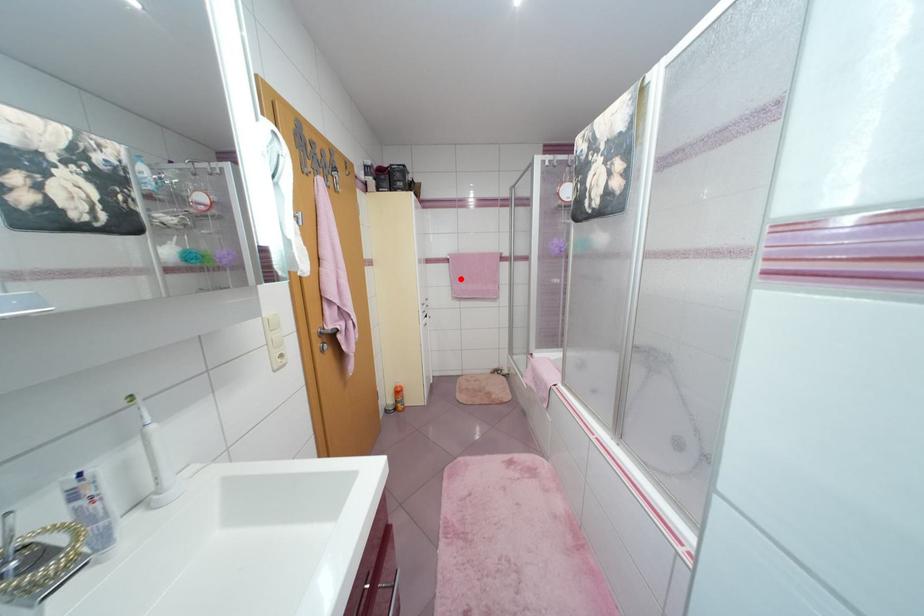
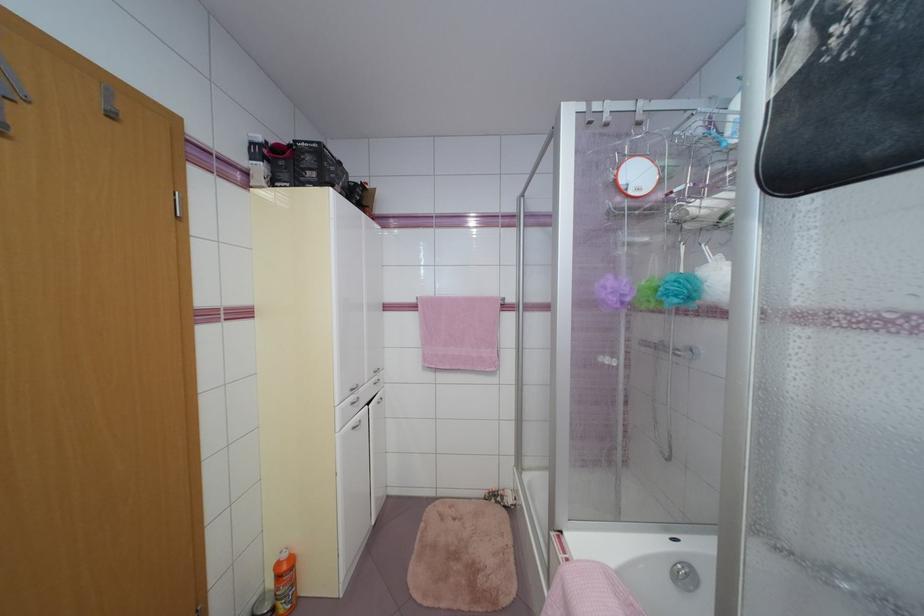
Question: I am providing you with two images of the same scene from different viewpoints. A red point is shown in image1. For the corresponding object point in image2, is it positioned nearer or farther from the camera?

Choices:
 (A) Nearer
 (B) Farther

Answer: (B)